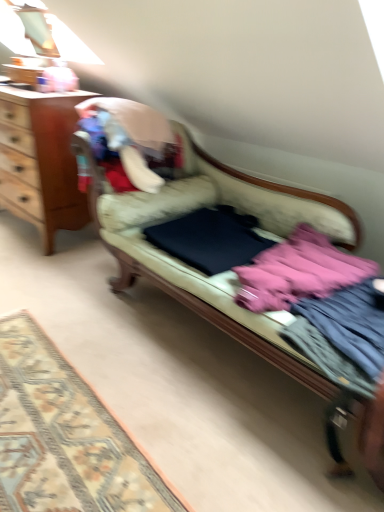
The width and height of the screenshot is (384, 512). I want to click on vacant space situated above carpeted rug at lower left (from a real-world perspective), so click(x=55, y=414).